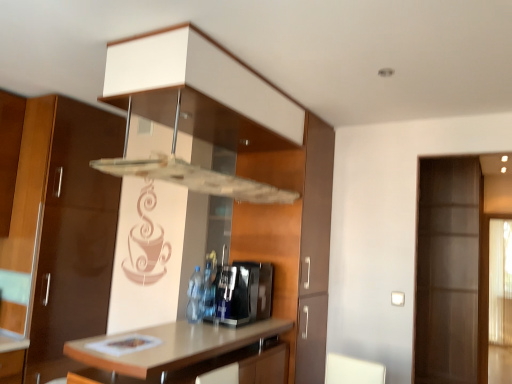
The width and height of the screenshot is (512, 384). I want to click on vacant point to the right of translucent plastic bottle at center, so click(219, 326).